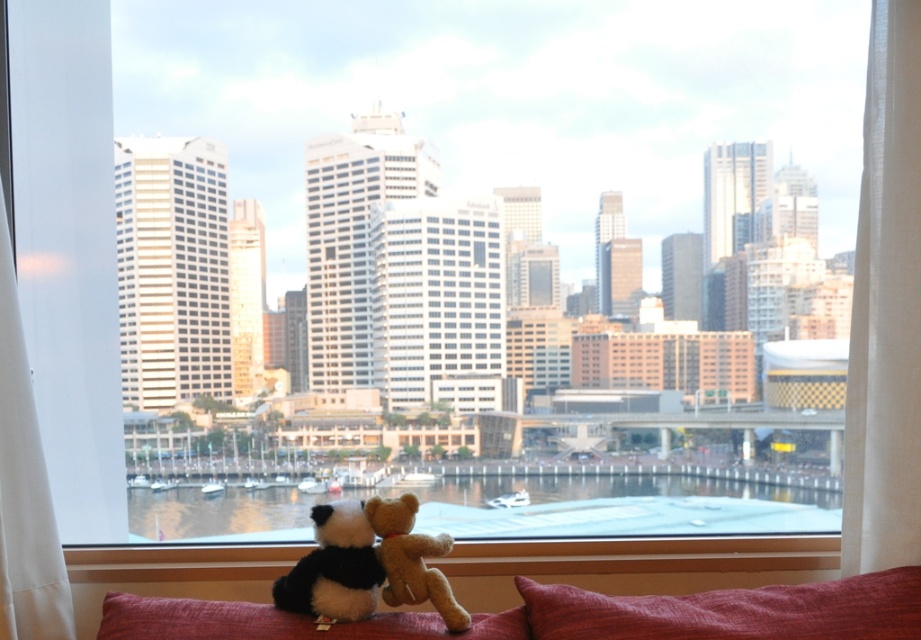
You are standing in the room looking out the window. You see the clear water at center and the white sheer curtain at left. Which object is closer to the right edge of the window?

The clear water at center is positioned on the right side of white sheer curtain at left, so the clear water at center is closer to the right edge of the window.

You are sitting on the velvet red couch at lower center and want to look at the clear water at center. Which object is nearer to you when you look straight ahead?

The velvet red couch at lower center is closer to the viewer than the clear water at center, so the velvet red couch at lower center is nearer to you when you look straight ahead.

You are looking through the window in the room. You see the clear water at center and the brown plush bear at lower center. Which object is closer to you?

The brown plush bear at lower center is closer to you because it is positioned in front of the clear water at center.